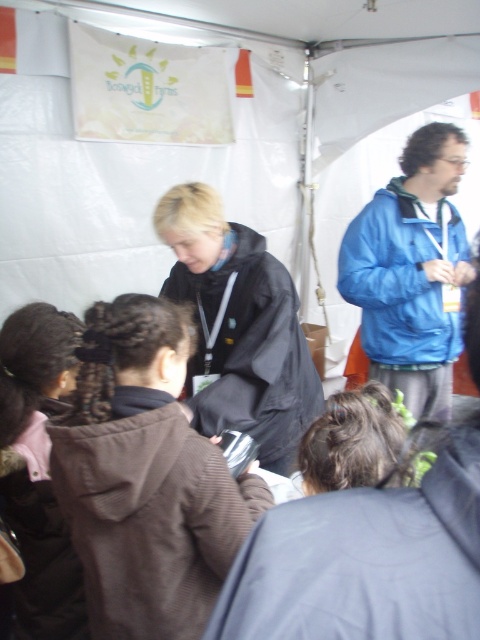
You are organizing a small event and need to decide seating arrangements. You have two jackets as markers for VIP seats. The black matte jacket at center and the blue jacket at upper right are placed on chairs. Which jacket should you choose if you want the marker to be wider to catch more attention?

The blue jacket at upper right should be chosen because it has a greater width compared to the black matte jacket at center, making it more noticeable as a VIP seat marker.